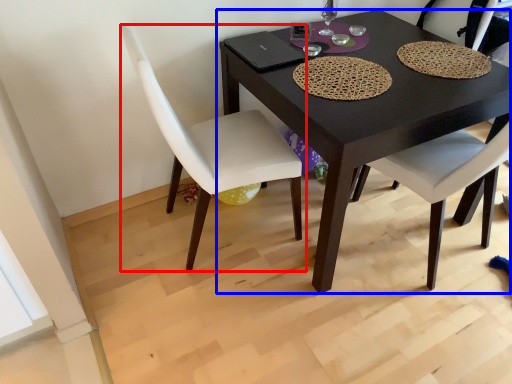
Question: Which point is closer to the camera, chair (highlighted by a red box) or table (highlighted by a blue box)?

Choices:
 (A) chair
 (B) table

Answer: (A)